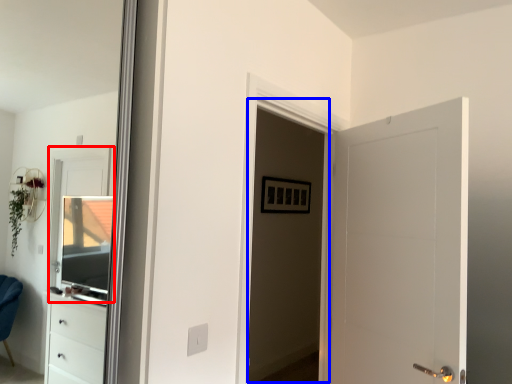
Question: Which object appears farthest to the camera in this image, window (highlighted by a red box) or screen door (highlighted by a blue box)?

Choices:
 (A) window
 (B) screen door

Answer: (A)